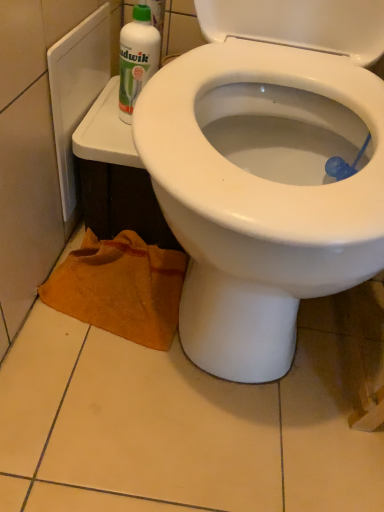
Question: From the image's perspective, relative to white glossy bidet at center, is orange towel at lower left above or below?

Choices:
 (A) below
 (B) above

Answer: (A)

Question: Is point (107, 249) closer or farther from the camera than point (226, 330)?

Choices:
 (A) closer
 (B) farther

Answer: (B)

Question: Which object is positioned closest to the orange towel at lower left?

Choices:
 (A) white plastic bottle at upper left
 (B) white glossy bidet at center

Answer: (B)

Question: Which object is positioned closest to the orange towel at lower left?

Choices:
 (A) white plastic bottle at upper left
 (B) white glossy bidet at center

Answer: (B)